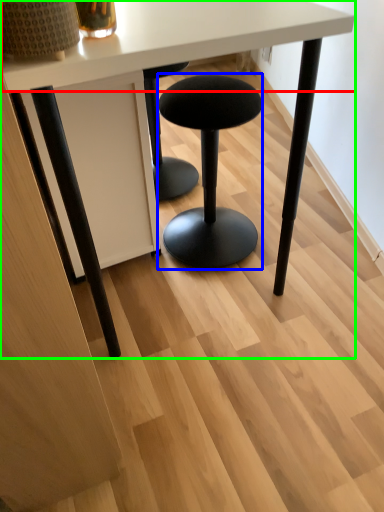
Question: Considering the real-world distances, which object is farthest from round table (highlighted by a red box)? stool (highlighted by a blue box) or table (highlighted by a green box)?

Choices:
 (A) stool
 (B) table

Answer: (A)